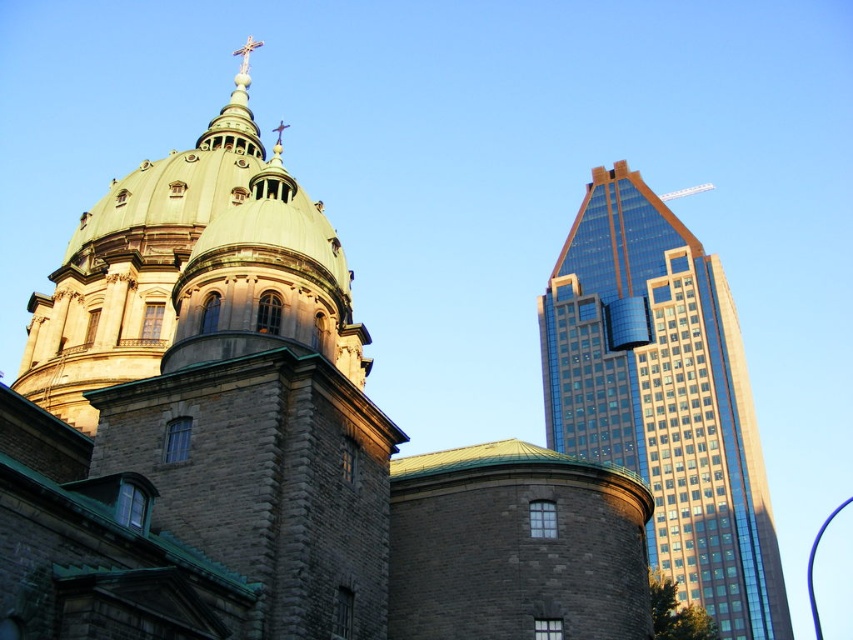
Question: Which point appears closest to the camera in this image?

Choices:
 (A) (628, 396)
 (B) (9, 458)

Answer: (B)

Question: Is the position of brown stone church at center less distant than that of shiny glass skyscraper at right?

Choices:
 (A) yes
 (B) no

Answer: (A)

Question: Can you confirm if brown stone church at center is positioned to the right of shiny glass skyscraper at right?

Choices:
 (A) yes
 (B) no

Answer: (B)

Question: Is brown stone church at center to the right of shiny glass skyscraper at right from the viewer's perspective?

Choices:
 (A) yes
 (B) no

Answer: (B)

Question: Which of the following is the farthest from the observer?

Choices:
 (A) (131, 532)
 (B) (723, 621)

Answer: (B)